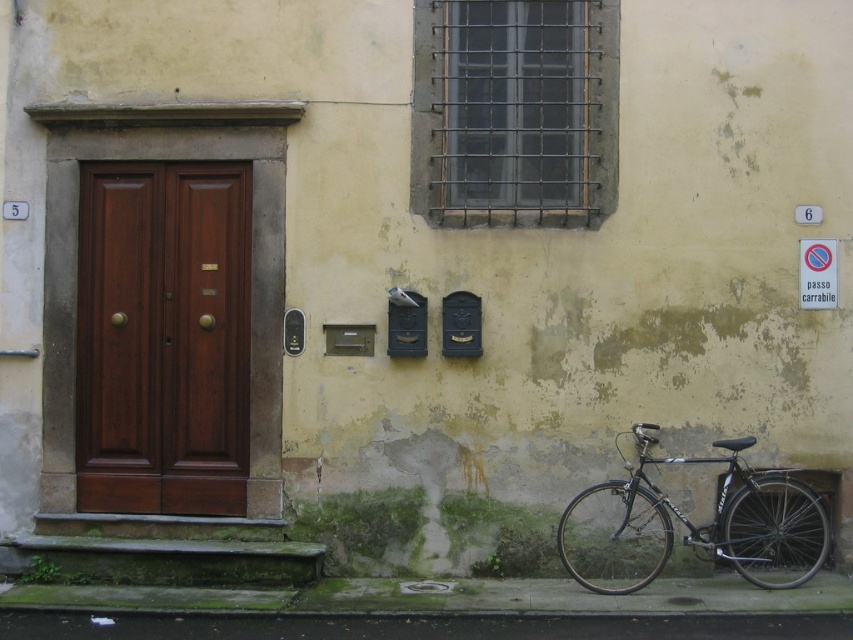
You are standing in front of a building and want to take a photo of the mahogany wood door at left. If your camera can focus on objects up to 10 meters away, will it be able to capture the door clearly?

The mahogany wood door at left is 8.26 meters from camera, which is within the camera focus range of up to 10 meters. Therefore, the camera can capture the door clearly.

You are standing in front of the building shown in the scene. You notice a specific point on the wall at coordinates (161, 339). What object is located at this point?

The point at coordinates (161, 339) indicates the mahogany wood door at left.